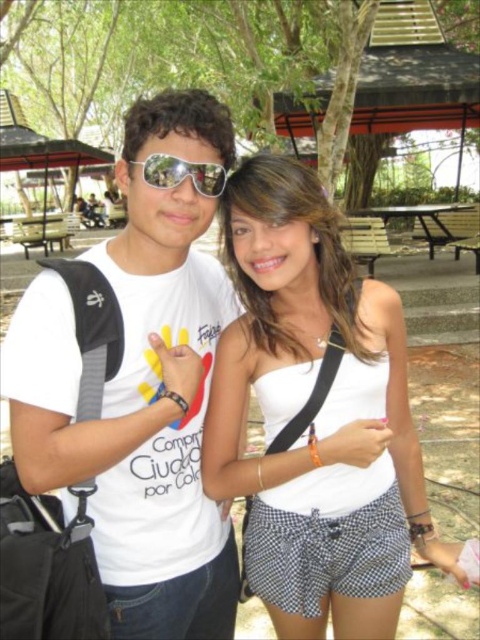
Question: Among these points, which one is farthest from the camera?

Choices:
 (A) (145, 164)
 (B) (372, 504)

Answer: (B)

Question: Can you confirm if white matte t-shirt at center is positioned below checkered fabric shorts at lower center?

Choices:
 (A) yes
 (B) no

Answer: (B)

Question: Is the position of white matte t-shirt at center less distant than that of checkered fabric shorts at lower center?

Choices:
 (A) yes
 (B) no

Answer: (A)

Question: Is white matte t-shirt at center to the right of sunglasses at center from the viewer's perspective?

Choices:
 (A) no
 (B) yes

Answer: (A)

Question: Which point is farther to the camera?

Choices:
 (A) (437, 218)
 (B) (357, 381)
 (C) (144, 592)
 (D) (267, 538)

Answer: (A)

Question: Estimate the real-world distances between objects in this image. Which object is closer to the white matte t-shirt at center?

Choices:
 (A) brown wooden picnic table at center
 (B) white cotton tank top at center

Answer: (B)